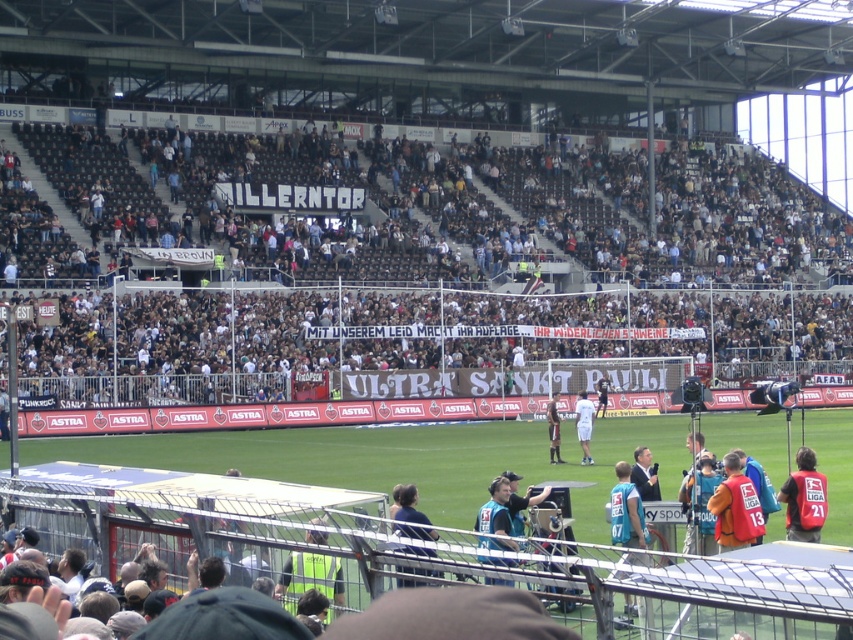
You are a photographer at the soccer stadium. You need to capture a photo that includes both the orange jersey at right and the white fabric shirt at center. Which of these two items should you focus on first to ensure they both fit in the frame?

The orange jersey at right is smaller than the white fabric shirt at center, so you should focus on the white fabric shirt at center first to ensure both fit in the frame.

You are a photographer at the soccer stadium and want to capture a clear shot of the white fabric shirt at center and the dark brown leather jacket at center. Which object should you focus on first if you want to take a photo where the subject appears closer to the camera?

The white fabric shirt at center is above the dark brown leather jacket at center, so focusing on the white fabric shirt at center first will make it appear closer to the camera in the photo.

You are a photographer at the soccer stadium and need to capture a clear shot of the two items in the center of the image. The white fabric shirt at center and the dark brown leather jacket at center. Which item should you focus on first if you want to ensure both are in frame without moving the camera?

The white fabric shirt at center is taller than the dark brown leather jacket at center. Since the white fabric shirt at center is taller, you should focus on it first to ensure the entire height of both items fits within the frame.